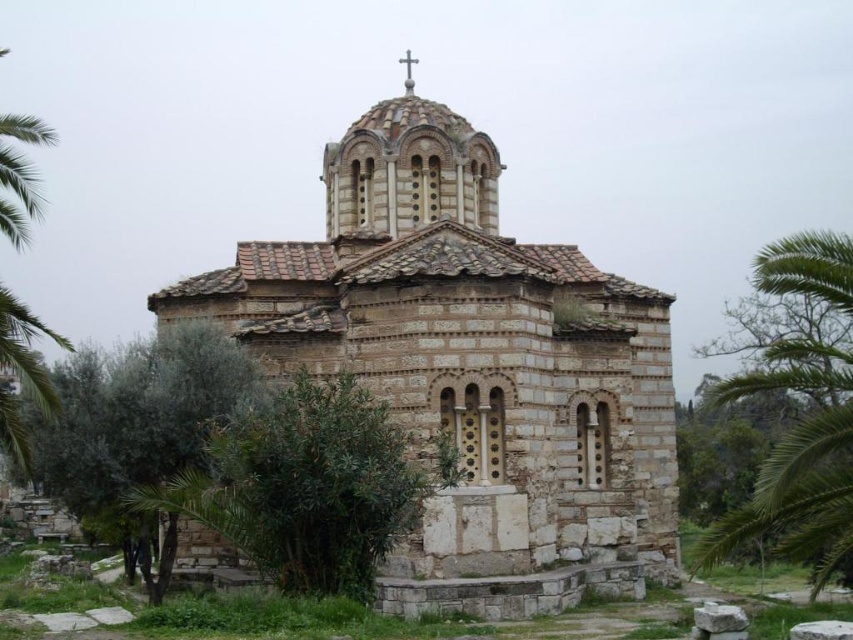
You are standing in front of the ancient stone church and want to take a photo. There are two points marked in the image, point 1 at coordinates (190, 486) and point 2 at coordinates (776, 516). Which point is closer to your camera lens?

Point 1 at coordinates (190, 486) is closer to the camera lens because it is further to the camera than point 2 at coordinates (776, 516).

You are standing in front of the ancient stone church and notice two plants. One is the green leafy bush at center, and the other is the green leafy palm tree at right. Which of these two plants is positioned more to the left side of the church?

The green leafy bush at center is positioned more to the left side of the church compared to the green leafy palm tree at right.

You are standing in front of an ancient stone church with Byzantine architecture. You notice a point marked at coordinates (277, 509). If you want to take a photo of this point, will you need to zoom in or out to include it in your shot?

The point at (277, 509) is 50.06 meters away from the camera. To capture it in your photo, you would need to zoom out to include the distant point in the frame.